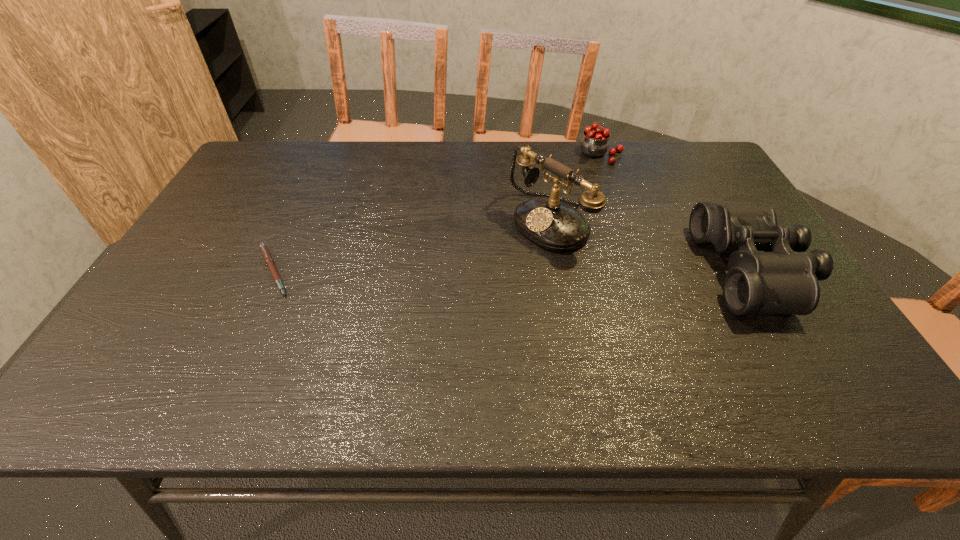
The image size is (960, 540). In the image, there is a desktop. What are the coordinates of `vacant space at the near edge` in the screenshot? It's located at (540, 355).

Where is `free location at the left edge`? free location at the left edge is located at coordinates (226, 189).

The height and width of the screenshot is (540, 960). What are the coordinates of `vacant region at the right edge of the desktop` in the screenshot? It's located at (692, 192).

Where is `free space at the far left corner of the desktop`? This screenshot has width=960, height=540. free space at the far left corner of the desktop is located at coordinates (251, 176).

Image resolution: width=960 pixels, height=540 pixels. In the image, there is a desktop. What are the coordinates of `vacant space at the near left corner` in the screenshot? It's located at (156, 357).

The height and width of the screenshot is (540, 960). In order to click on vacant space at the far right corner of the desktop in this screenshot , I will do `click(672, 158)`.

Where is `vacant area at the near right corner of the desktop`? The width and height of the screenshot is (960, 540). vacant area at the near right corner of the desktop is located at coordinates (759, 332).

This screenshot has height=540, width=960. What are the coordinates of `vacant region between the rightmost object and the farthest object` in the screenshot? It's located at (676, 212).

At what (x,y) coordinates should I click in order to perform the action: click on vacant space in between the rightmost object and the telephone. Please return your answer as a coordinate pair (x, y). This screenshot has height=540, width=960. Looking at the image, I should click on (651, 246).

Identify the location of unoccupied area between the third object from left to right and the pen. (436, 213).